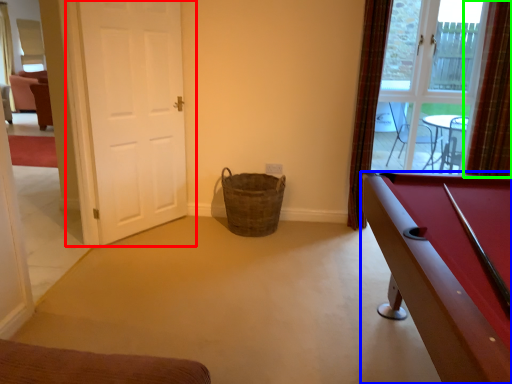
Question: Estimate the real-world distances between objects in this image. Which object is farther from door (highlighted by a red box), billiard table (highlighted by a blue box) or curtain (highlighted by a green box)?

Choices:
 (A) billiard table
 (B) curtain

Answer: (B)